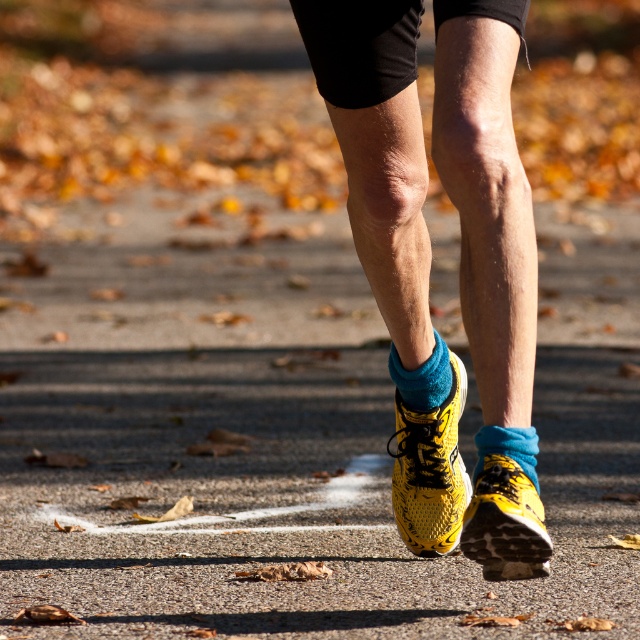
I want to click on yellow mesh shoe at lower center, so [506, 522].

Where is `yellow mesh shoe at lower center`? yellow mesh shoe at lower center is located at coordinates (506, 522).

Which is above, yellow mesh running shoes at center or yellow mesh shoe at center?

yellow mesh running shoes at center is above.

Can you confirm if yellow mesh running shoes at center is wider than yellow mesh shoe at center?

Yes, yellow mesh running shoes at center is wider than yellow mesh shoe at center.

Which is in front, point (342, 51) or point (426, 422)?

Point (342, 51) is in front.

Locate an element on the screen. This screenshot has height=640, width=640. yellow mesh running shoes at center is located at coordinates (486, 196).

Can you confirm if yellow mesh running shoes at center is taller than blue fleece sock at lower center?

Yes.

Which is behind, point (509, 259) or point (536, 433)?

The point (536, 433) is more distant.

Between point (438, 154) and point (483, 432), which one is positioned in front?

Positioned in front is point (438, 154).

The height and width of the screenshot is (640, 640). In order to click on yellow mesh running shoes at center in this screenshot , I will do `click(486, 196)`.